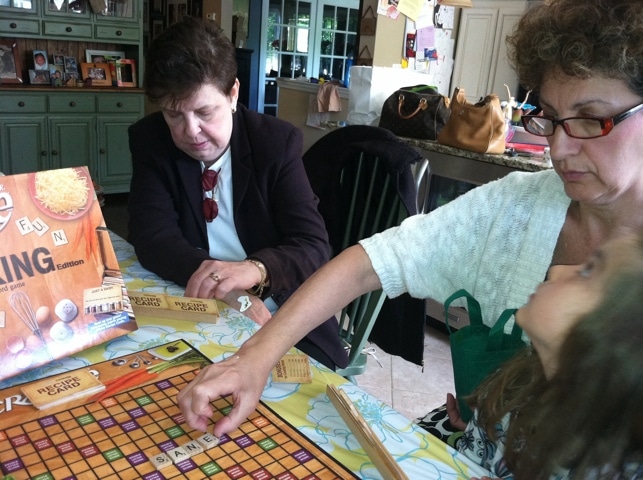
I want to click on scrabble board, so click(x=140, y=433).